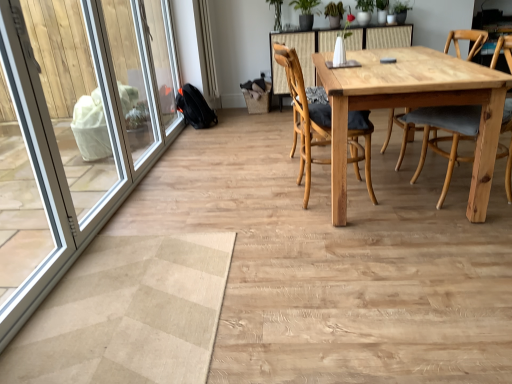
The width and height of the screenshot is (512, 384). I want to click on empty space that is in between white plastic screen door at left and natural wood table at center, so click(x=228, y=198).